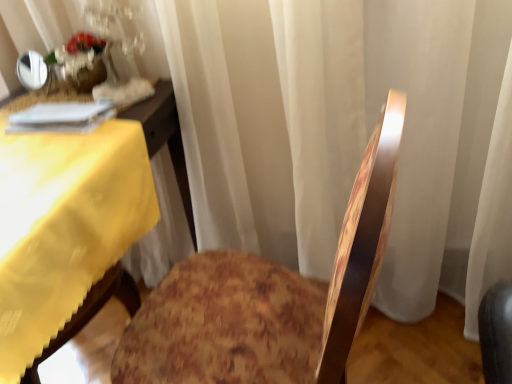
Question: Are yellow fabric table at left and wooden floral-patterned chair at center making contact?

Choices:
 (A) yes
 (B) no

Answer: (B)

Question: Can you confirm if yellow fabric table at left is taller than wooden floral-patterned chair at center?

Choices:
 (A) no
 (B) yes

Answer: (A)

Question: Considering the relative sizes of yellow fabric table at left and wooden floral-patterned chair at center in the image provided, is yellow fabric table at left smaller than wooden floral-patterned chair at center?

Choices:
 (A) no
 (B) yes

Answer: (B)

Question: Can you confirm if yellow fabric table at left is wider than wooden floral-patterned chair at center?

Choices:
 (A) yes
 (B) no

Answer: (A)

Question: Can you confirm if yellow fabric table at left is positioned to the left of wooden floral-patterned chair at center?

Choices:
 (A) yes
 (B) no

Answer: (A)

Question: From a real-world perspective, is yellow fabric table at left located beneath wooden floral-patterned chair at center?

Choices:
 (A) yes
 (B) no

Answer: (B)

Question: Does translucent glass vase at upper left have a greater height compared to wooden floral-patterned chair at center?

Choices:
 (A) yes
 (B) no

Answer: (B)

Question: Considering the relative sizes of translucent glass vase at upper left and wooden floral-patterned chair at center in the image provided, is translucent glass vase at upper left bigger than wooden floral-patterned chair at center?

Choices:
 (A) no
 (B) yes

Answer: (A)

Question: Does translucent glass vase at upper left appear on the left side of wooden floral-patterned chair at center?

Choices:
 (A) no
 (B) yes

Answer: (B)

Question: From a real-world perspective, is translucent glass vase at upper left under wooden floral-patterned chair at center?

Choices:
 (A) yes
 (B) no

Answer: (B)

Question: Is translucent glass vase at upper left in front of wooden floral-patterned chair at center?

Choices:
 (A) yes
 (B) no

Answer: (B)

Question: From the image's perspective, is translucent glass vase at upper left on wooden floral-patterned chair at center?

Choices:
 (A) no
 (B) yes

Answer: (B)

Question: From the image's perspective, is yellow fabric table at left below translucent glass vase at upper left?

Choices:
 (A) no
 (B) yes

Answer: (B)